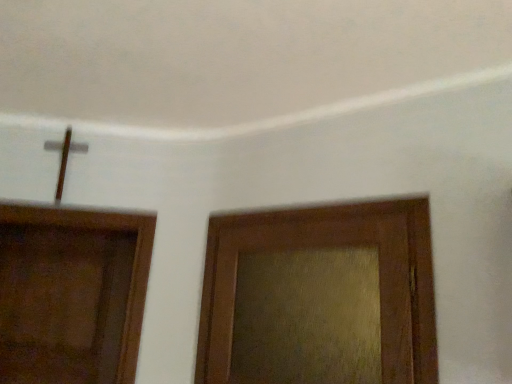
Question: Considering the relative sizes of brown wooden door at left, which is counted as the 1th door, starting from the back, and wooden textured door at right, the 2th door positioned from the left, in the image provided, is brown wooden door at left, which is counted as the 1th door, starting from the back, taller than wooden textured door at right, the 2th door positioned from the left,?

Choices:
 (A) no
 (B) yes

Answer: (B)

Question: Is brown wooden door at left, placed as the first door when sorted from left to right, next to wooden textured door at right, the 2th door positioned from the left?

Choices:
 (A) yes
 (B) no

Answer: (B)

Question: From the image's perspective, is brown wooden door at left, placed as the first door when sorted from left to right, above wooden textured door at right, which ranks as the 1th door in front-to-back order?

Choices:
 (A) yes
 (B) no

Answer: (B)

Question: Can we say brown wooden door at left, which ranks as the 2th door in front-to-back order, lies outside wooden textured door at right, the 2th door positioned from the left?

Choices:
 (A) yes
 (B) no

Answer: (A)

Question: Is brown wooden door at left, placed as the first door when sorted from left to right, further to camera compared to wooden textured door at right, the 2th door positioned from the left?

Choices:
 (A) yes
 (B) no

Answer: (A)

Question: Does brown wooden door at left, positioned as the 2th door in right-to-left order, have a greater width compared to wooden textured door at right, the 2th door positioned from the left?

Choices:
 (A) no
 (B) yes

Answer: (B)

Question: Does wooden textured door at right, which ranks as the 1th door in front-to-back order, appear on the right side of brown wooden door at left, placed as the first door when sorted from left to right?

Choices:
 (A) no
 (B) yes

Answer: (B)

Question: Considering the relative positions of wooden textured door at right, which ranks as the 1th door in front-to-back order, and brown wooden door at left, which ranks as the 2th door in front-to-back order, in the image provided, is wooden textured door at right, which ranks as the 1th door in front-to-back order, behind brown wooden door at left, which ranks as the 2th door in front-to-back order,?

Choices:
 (A) no
 (B) yes

Answer: (A)

Question: Considering the relative sizes of wooden textured door at right, placed as the second door when sorted from back to front, and brown wooden door at left, positioned as the 2th door in right-to-left order, in the image provided, is wooden textured door at right, placed as the second door when sorted from back to front, taller than brown wooden door at left, positioned as the 2th door in right-to-left order,?

Choices:
 (A) no
 (B) yes

Answer: (A)

Question: Is wooden textured door at right, the 2th door positioned from the left, positioned far away from brown wooden door at left, placed as the first door when sorted from left to right?

Choices:
 (A) no
 (B) yes

Answer: (A)

Question: From the image's perspective, would you say wooden textured door at right, which ranks as the 1th door in front-to-back order, is shown under brown wooden door at left, which is counted as the 1th door, starting from the back?

Choices:
 (A) yes
 (B) no

Answer: (B)

Question: Does wooden textured door at right, placed as the second door when sorted from back to front, come in front of brown wooden door at left, positioned as the 2th door in right-to-left order?

Choices:
 (A) yes
 (B) no

Answer: (A)

Question: Is wooden textured door at right, which ranks as the 1th door in front-to-back order, bigger or smaller than brown wooden door at left, positioned as the 2th door in right-to-left order?

Choices:
 (A) small
 (B) big

Answer: (A)